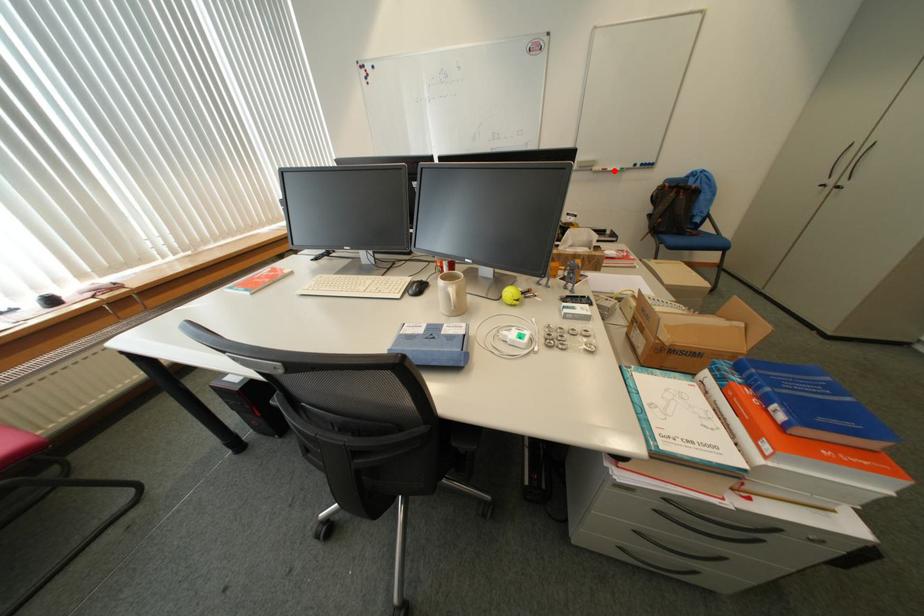
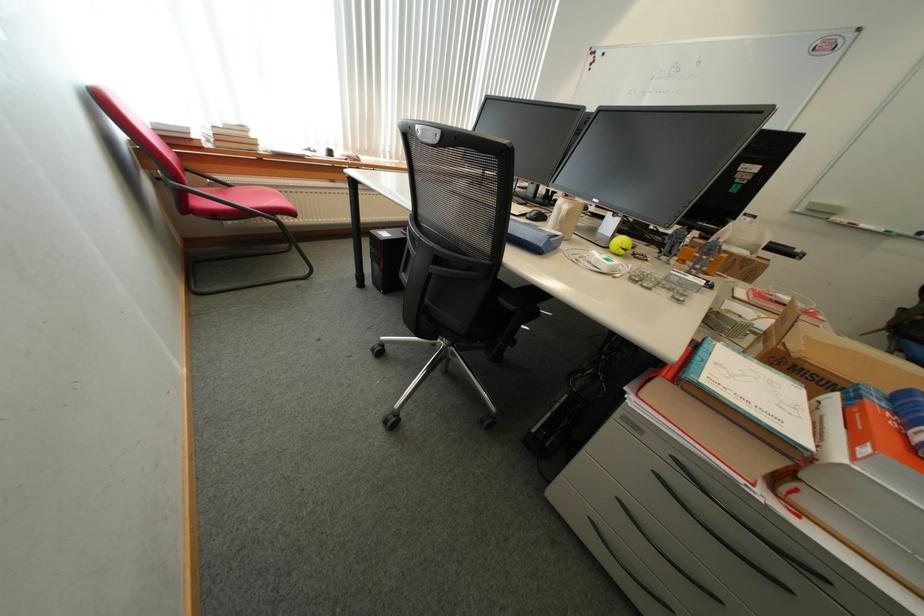
Locate, in the second image, the point that corresponds to the highlighted location in the first image.

(861, 225)